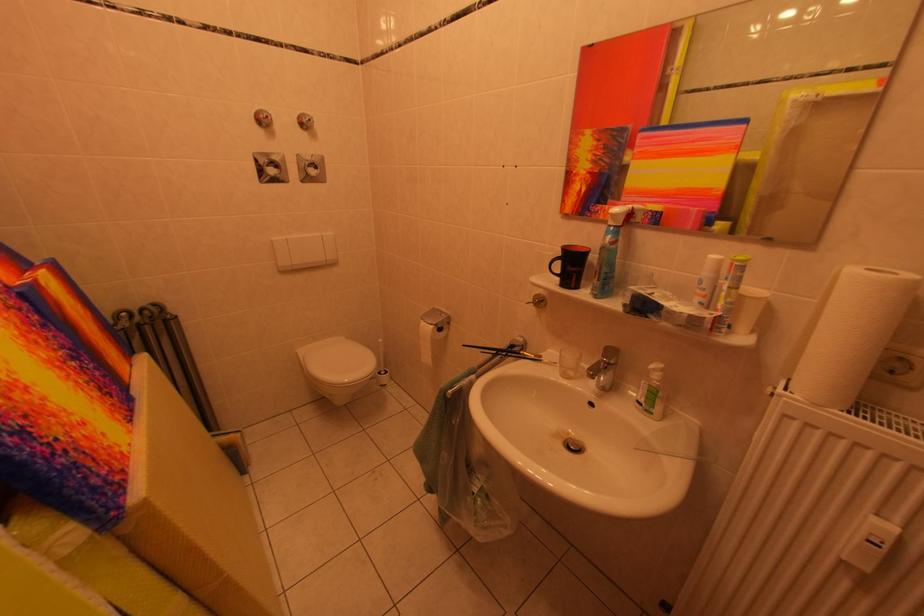
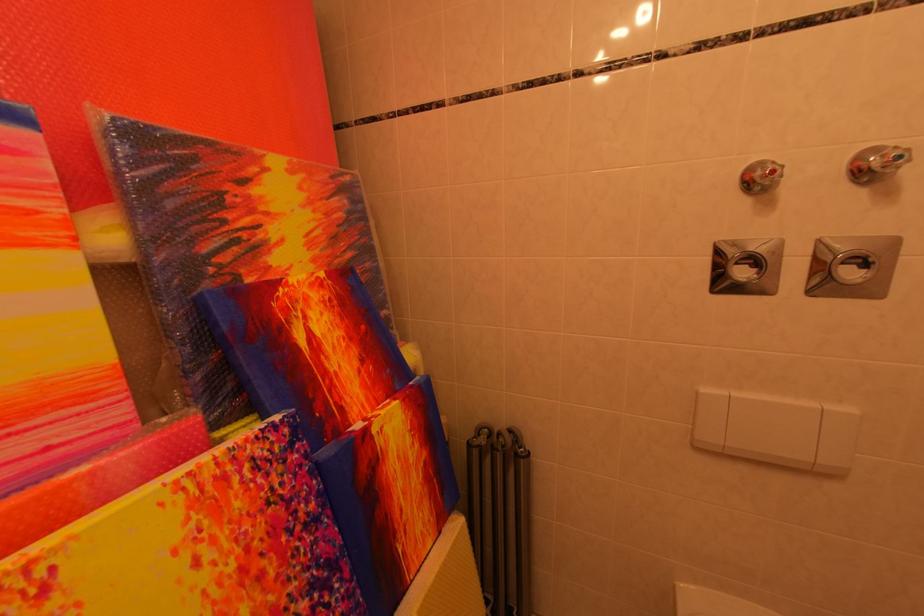
Find the pixel in the second image that matches (322,172) in the first image.

(864, 270)